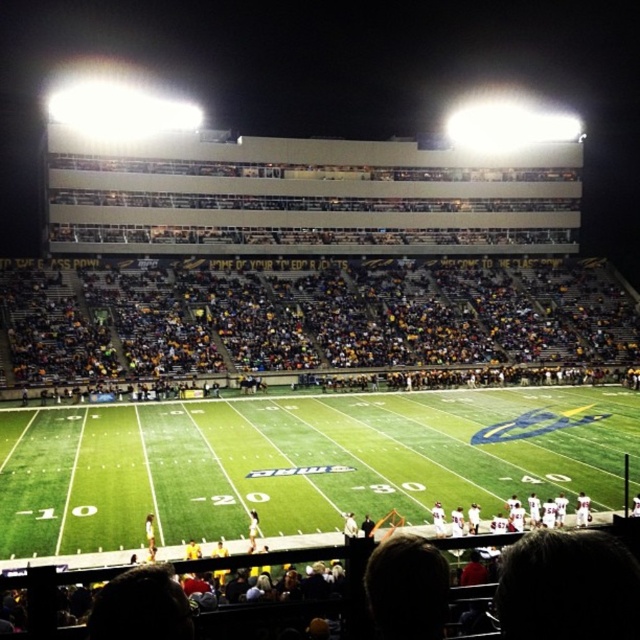
Question: Which of the following is the closest to the observer?

Choices:
 (A) (172, 516)
 (B) (225, 353)

Answer: (A)

Question: Can you confirm if green turf football field at center is positioned below yellow fabric seats at lower center?

Choices:
 (A) no
 (B) yes

Answer: (B)

Question: Is green turf football field at center smaller than yellow fabric seats at lower center?

Choices:
 (A) yes
 (B) no

Answer: (A)

Question: Can you confirm if green turf football field at center is smaller than yellow fabric seats at lower center?

Choices:
 (A) no
 (B) yes

Answer: (B)

Question: Which object is closer to the camera taking this photo?

Choices:
 (A) yellow fabric seats at lower center
 (B) green turf football field at center

Answer: (B)